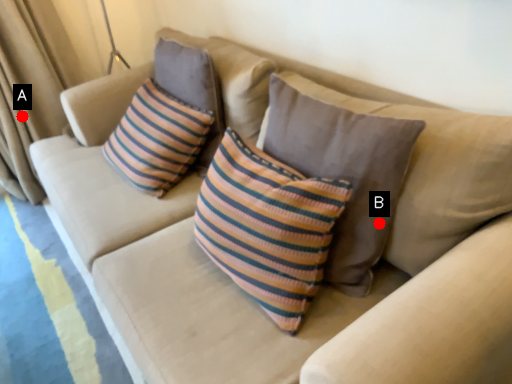
Question: Two points are circled on the image, labeled by A and B beside each circle. Which point is further to the camera?

Choices:
 (A) A is further
 (B) B is further

Answer: (A)